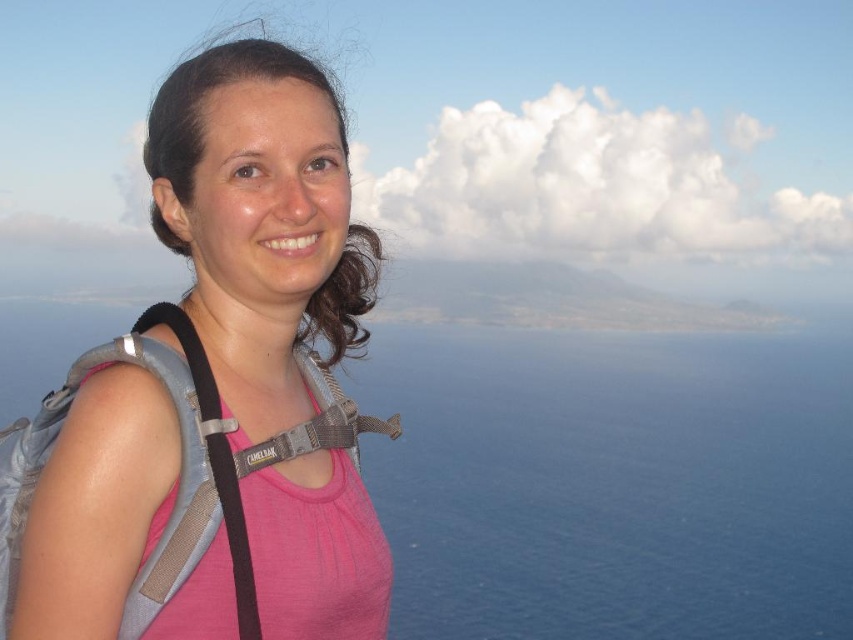
Question: Does blue water at center have a smaller size compared to pink fabric shirt at left?

Choices:
 (A) no
 (B) yes

Answer: (A)

Question: Is blue water at center above pink fabric shirt at left?

Choices:
 (A) no
 (B) yes

Answer: (A)

Question: Is blue water at center thinner than pink fabric shirt at left?

Choices:
 (A) yes
 (B) no

Answer: (B)

Question: Which object is farther from the camera taking this photo?

Choices:
 (A) blue water at center
 (B) pink fabric shirt at left

Answer: (A)